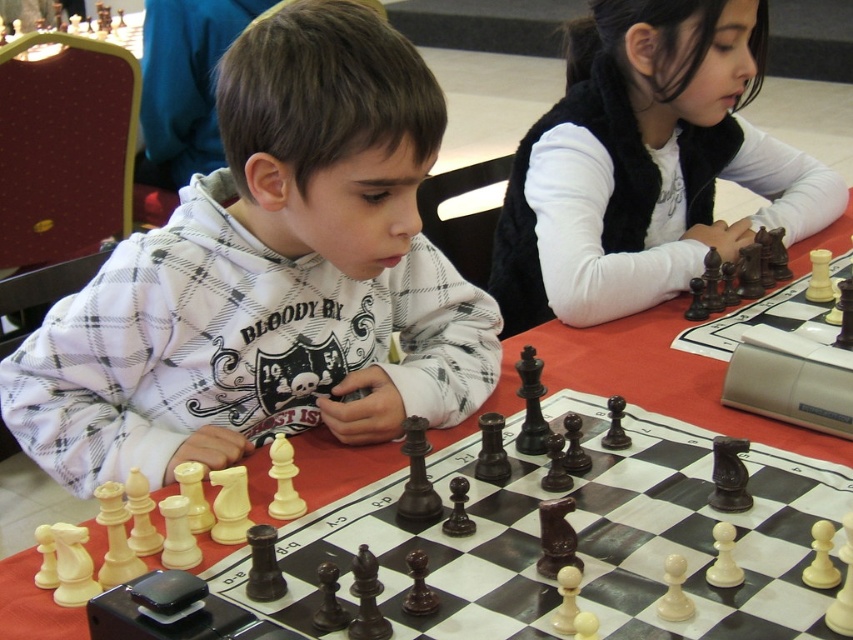
Question: Considering the real-world distances, which object is closest to the white fleece hoodie at center?

Choices:
 (A) white fleece vest at upper right
 (B) wooden chessboard at center

Answer: (B)

Question: Can you confirm if white fleece hoodie at center is positioned above wooden chessboard at center?

Choices:
 (A) no
 (B) yes

Answer: (B)

Question: Which point appears closest to the camera in this image?

Choices:
 (A) (741, 10)
 (B) (13, 598)
 (C) (271, 349)

Answer: (B)

Question: Does white fleece vest at upper right lie behind wooden chessboard at center?

Choices:
 (A) yes
 (B) no

Answer: (A)

Question: From the image, what is the correct spatial relationship of white fleece vest at upper right in relation to wooden chessboard at center?

Choices:
 (A) below
 (B) above

Answer: (B)

Question: Among these points, which one is nearest to the camera?

Choices:
 (A) (64, 634)
 (B) (631, 298)
 (C) (399, 428)

Answer: (A)